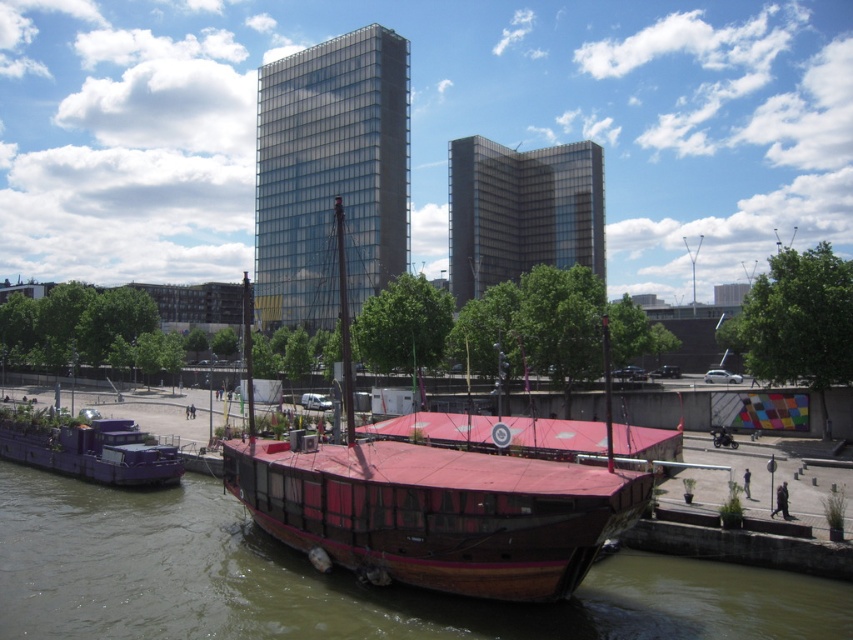
Between brown wooden boat at center and purple matte houseboat at lower left, which one appears on the left side from the viewer's perspective?

From the viewer's perspective, purple matte houseboat at lower left appears more on the left side.

Is point (152, 531) positioned behind point (164, 474)?

No, (152, 531) is in front of (164, 474).

Between point (65, 621) and point (64, 465), which one is positioned in front?

Point (65, 621)

Where is `brown wooden boat at center`? The height and width of the screenshot is (640, 853). brown wooden boat at center is located at coordinates (334, 580).

Locate an element on the screen. The image size is (853, 640). wooden boat at center is located at coordinates (430, 502).

Between wooden boat at center and purple matte houseboat at lower left, which one is positioned higher?

wooden boat at center

Who is more forward, (625,492) or (94,480)?

Point (625,492) is in front.

At what (x,y) coordinates should I click in order to perform the action: click on wooden boat at center. Please return your answer as a coordinate pair (x, y). This screenshot has height=640, width=853. Looking at the image, I should click on (430, 502).

Is point (126, 627) farther from viewer compared to point (549, 532)?

Yes, it is behind point (549, 532).

Is brown wooden boat at center positioned at the back of wooden boat at center?

Yes, brown wooden boat at center is behind wooden boat at center.

This screenshot has width=853, height=640. I want to click on brown wooden boat at center, so click(334, 580).